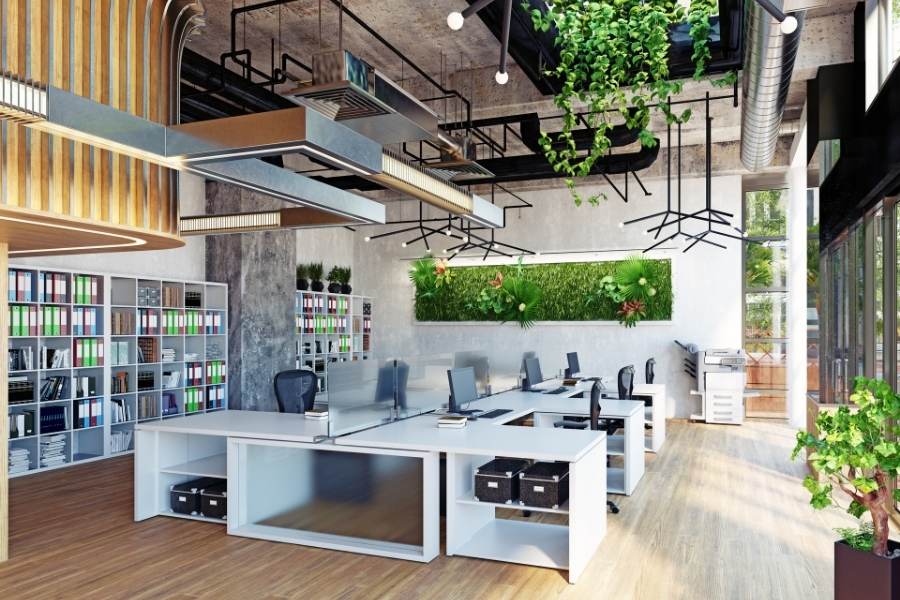
Find the location of `monitors`. monitors is located at coordinates (396, 376), (477, 361), (463, 345), (451, 383), (533, 367), (526, 348), (572, 361).